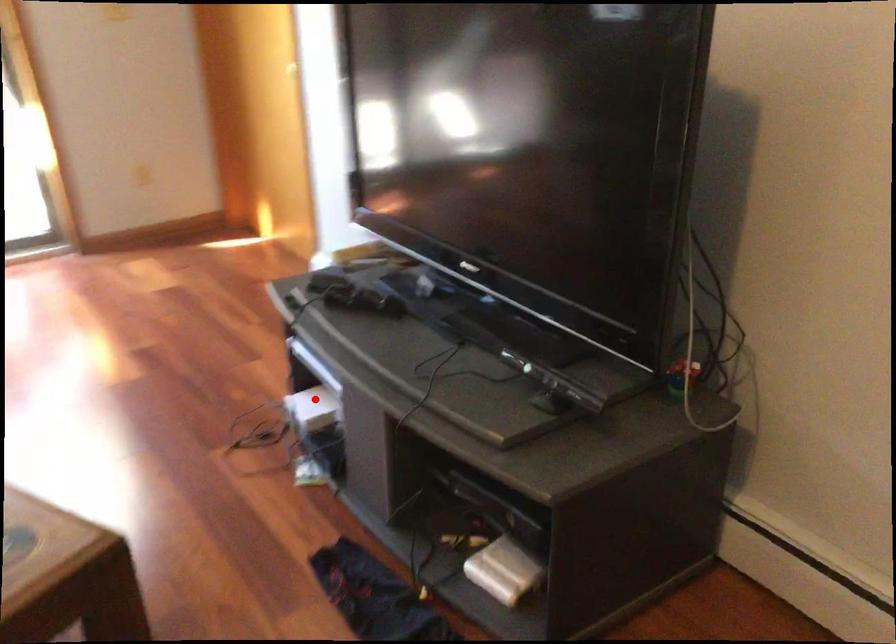
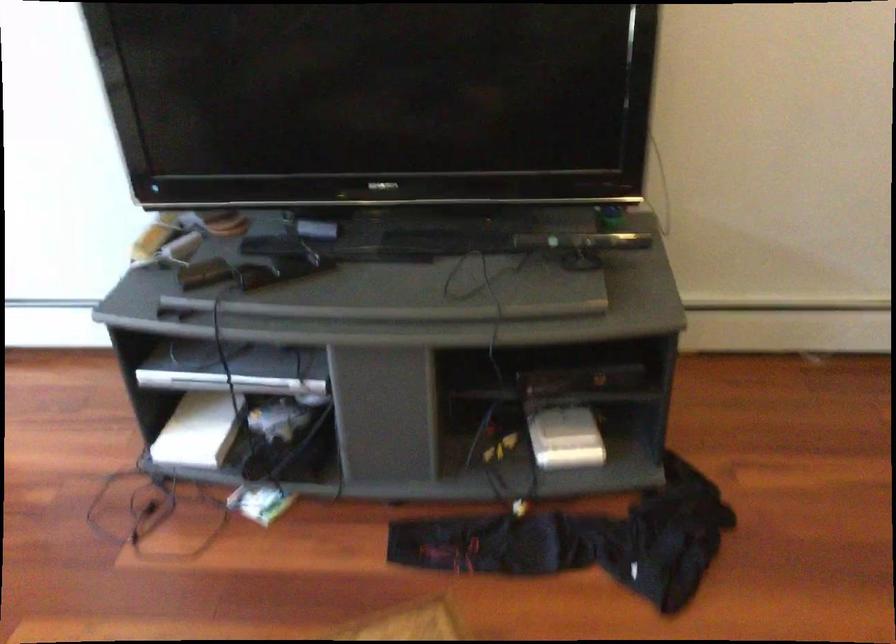
Question: I am providing you with two images of the same scene from different viewpoints. Given a red point in image1, look at the same physical point in image2. Is it:

Choices:
 (A) Closer to the viewpoint
 (B) Farther from the viewpoint

Answer: (A)